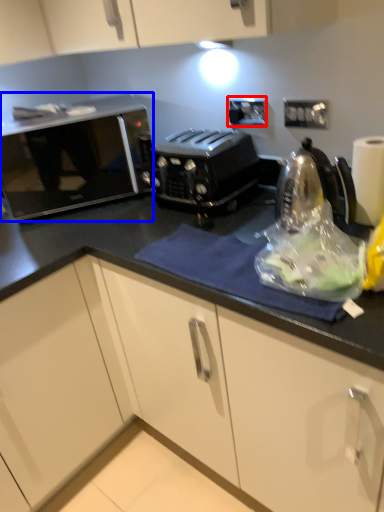
Question: Which object is closer to the camera taking this photo, electric outlet (highlighted by a red box) or home appliance (highlighted by a blue box)?

Choices:
 (A) electric outlet
 (B) home appliance

Answer: (B)